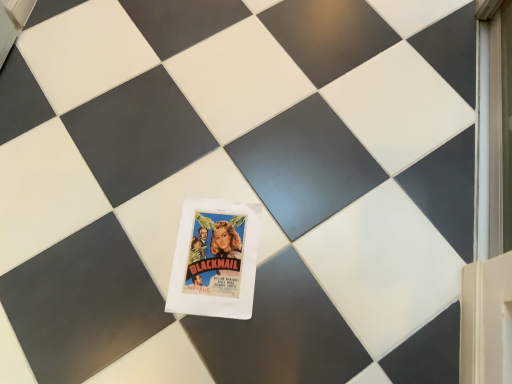
Measure the distance between point (192,200) and camera.

A distance of 1.13 meters exists between point (192,200) and camera.

What do you see at coordinates (215, 259) in the screenshot?
I see `matte paper poster at center` at bounding box center [215, 259].

This screenshot has width=512, height=384. In order to click on matte paper poster at center in this screenshot , I will do `click(215, 259)`.

Where is `matte paper poster at center`? The image size is (512, 384). matte paper poster at center is located at coordinates pyautogui.click(x=215, y=259).